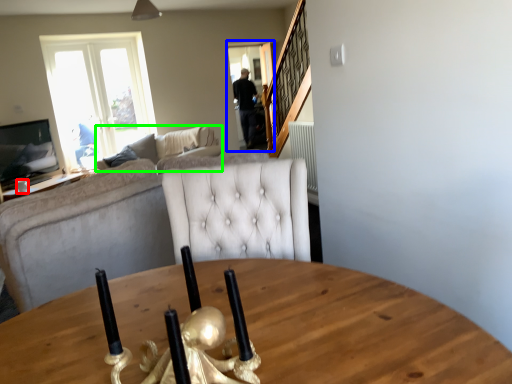
Question: Which is nearer to the coffee cup (highlighted by a red box)? glass door (highlighted by a blue box) or studio couch (highlighted by a green box).

Choices:
 (A) glass door
 (B) studio couch

Answer: (B)